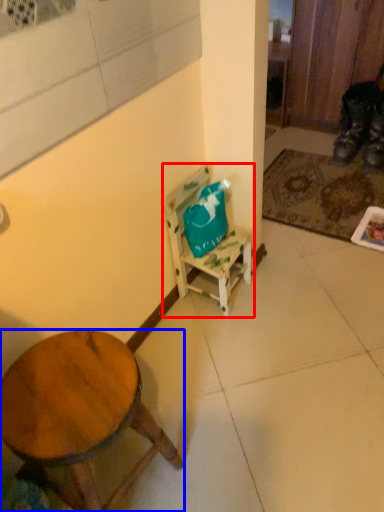
Question: Among these objects, which one is farthest to the camera, chair (highlighted by a red box) or desk (highlighted by a blue box)?

Choices:
 (A) chair
 (B) desk

Answer: (A)